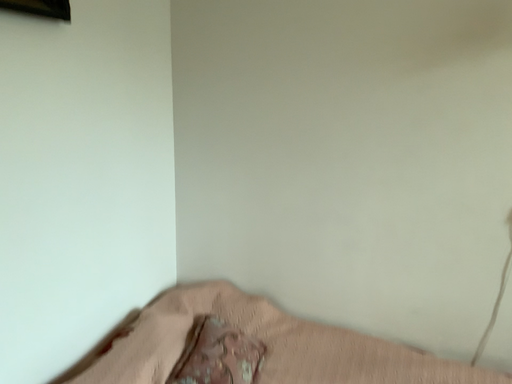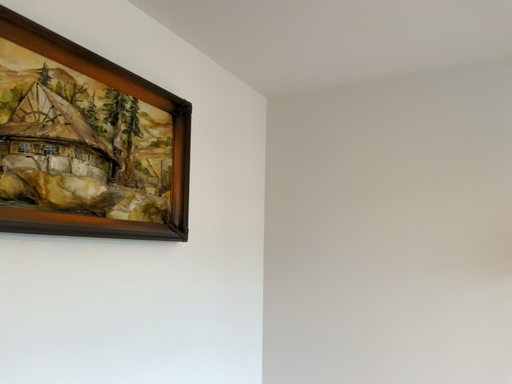
Question: Which way did the camera rotate in the video?

Choices:
 (A) rotated upward
 (B) rotated downward

Answer: (A)